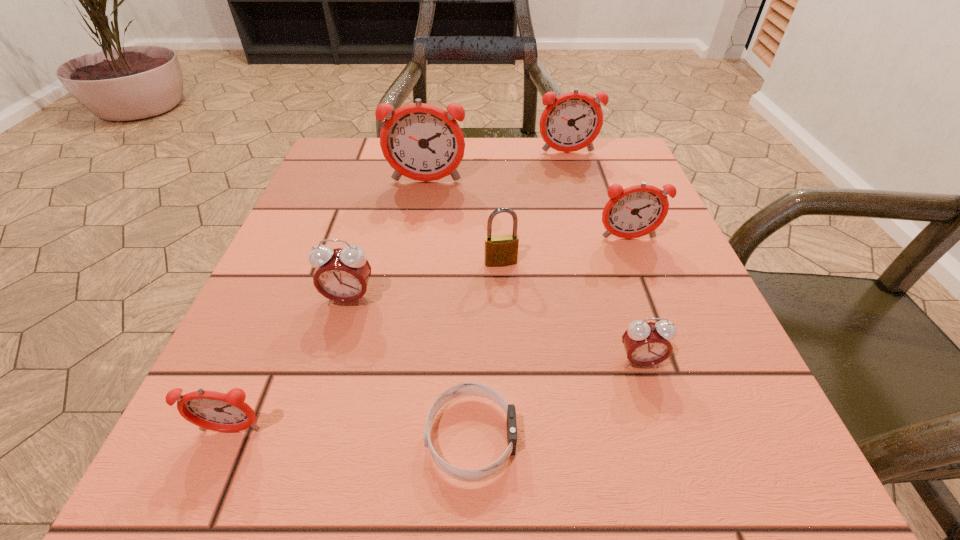
You are a GUI agent. You are given a task and a screenshot of the screen. Output one action in this format:
    pyautogui.click(x=<x>, y=<y>)
    Task: Click on the third nearest reddish-pink alarm clock
    The width and height of the screenshot is (960, 540).
    Given the screenshot: What is the action you would take?
    pyautogui.click(x=423, y=142)

What are the coordinates of `the tallest alarm clock` in the screenshot? It's located at (423, 142).

You are a GUI agent. You are given a task and a screenshot of the screen. Output one action in this format:
    pyautogui.click(x=<x>, y=<y>)
    Task: Click on the second tallest alarm clock
    
    Given the screenshot: What is the action you would take?
    pyautogui.click(x=572, y=121)

Locate an element on the screen. The width and height of the screenshot is (960, 540). the farthest reddish-pink alarm clock is located at coordinates [572, 121].

Identify the location of the farther pink alarm clock. The image size is (960, 540). (342, 275).

Where is `the bigger pink alarm clock`? the bigger pink alarm clock is located at coordinates (342, 275).

Locate an element on the screen. The width and height of the screenshot is (960, 540). the third biggest reddish-pink alarm clock is located at coordinates (636, 211).

The width and height of the screenshot is (960, 540). Identify the location of the third farthest alarm clock. (636, 211).

Locate an element on the screen. The height and width of the screenshot is (540, 960). the fourth farthest object is located at coordinates (501, 250).

The image size is (960, 540). In order to click on brass padlock in this screenshot , I will do `click(501, 250)`.